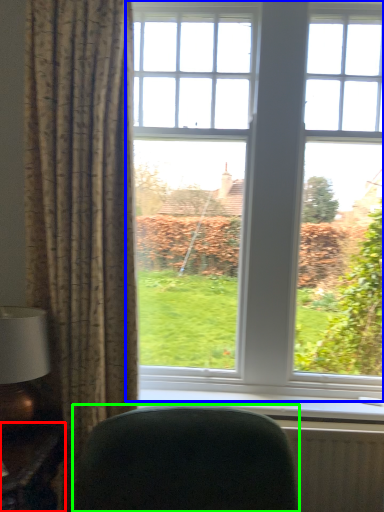
Question: Which is farther away from table (highlighted by a red box)? window (highlighted by a blue box) or furniture (highlighted by a green box)?

Choices:
 (A) window
 (B) furniture

Answer: (A)